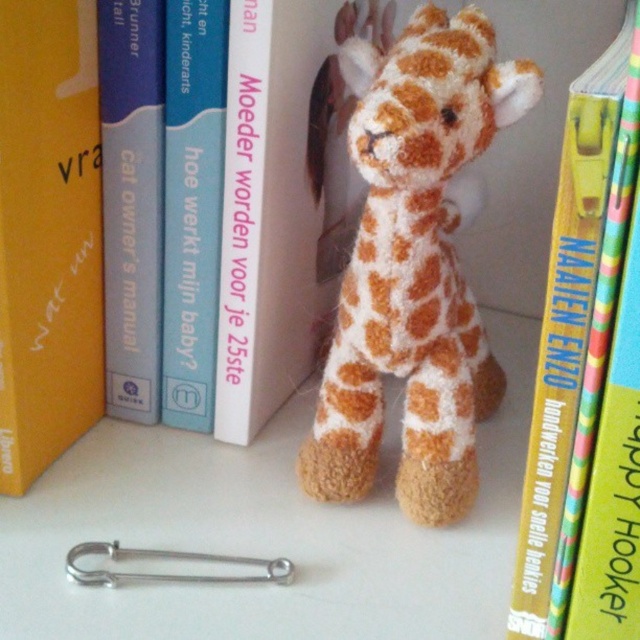
Which of these two, blue paperback book at left or blue paperback book at upper center, stands taller?

With more height is blue paperback book at upper center.

Is blue paperback book at left above blue paperback book at upper center?

Yes.

In order to click on blue paperback book at left in this screenshot , I will do `click(131, 202)`.

You are a GUI agent. You are given a task and a screenshot of the screen. Output one action in this format:
    pyautogui.click(x=<x>, y=<y>)
    Task: Click on the blue paperback book at left
    
    Given the screenshot: What is the action you would take?
    coord(131,202)

Who is higher up, fluffy orange and white plush giraffe at center or blue paperback book at upper center?

blue paperback book at upper center

Does fluffy orange and white plush giraffe at center appear over blue paperback book at upper center?

Incorrect, fluffy orange and white plush giraffe at center is not positioned above blue paperback book at upper center.

Is point (356, 298) more distant than point (209, 225)?

No, (356, 298) is closer to viewer.

Locate an element on the screen. The width and height of the screenshot is (640, 640). fluffy orange and white plush giraffe at center is located at coordinates (413, 266).

Who is positioned more to the left, yellow matte book at upper left or yellow paperback book at center?

From the viewer's perspective, yellow matte book at upper left appears more on the left side.

From the picture: How distant is yellow matte book at upper left from yellow paperback book at center?

yellow matte book at upper left is 60.56 centimeters from yellow paperback book at center.

Locate an element on the screen. yellow matte book at upper left is located at coordinates (49, 234).